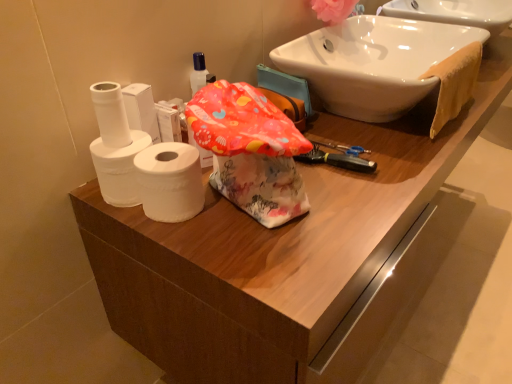
Question: Looking at the image, does orange cloth towel at upper right seem bigger or smaller compared to white matte toilet paper at left, arranged as the 3th toilet paper when viewed from the left?

Choices:
 (A) small
 (B) big

Answer: (B)

Question: Is point (461, 87) positioned closer to the camera than point (190, 183)?

Choices:
 (A) closer
 (B) farther

Answer: (B)

Question: Which of these objects is positioned farthest from the white matte toilet paper at left, arranged as the 3th toilet paper when viewed from the left?

Choices:
 (A) white matte toilet paper at left, the 2th toilet paper positioned from the right
 (B) white matte toilet paper at left, positioned as the 3th toilet paper in right-to-left order
 (C) pink fabric flower at upper right
 (D) white glossy sink at upper right
 (E) orange cloth towel at upper right

Answer: (C)

Question: Which object is positioned farthest from the white matte toilet paper at left, arranged as the 3th toilet paper when viewed from the left?

Choices:
 (A) white matte toilet paper at left, the 2th toilet paper positioned from the right
 (B) white matte toilet paper at left, positioned as the 3th toilet paper in right-to-left order
 (C) white glossy sink at upper right
 (D) pink fabric flower at upper right
 (E) orange cloth towel at upper right

Answer: (D)